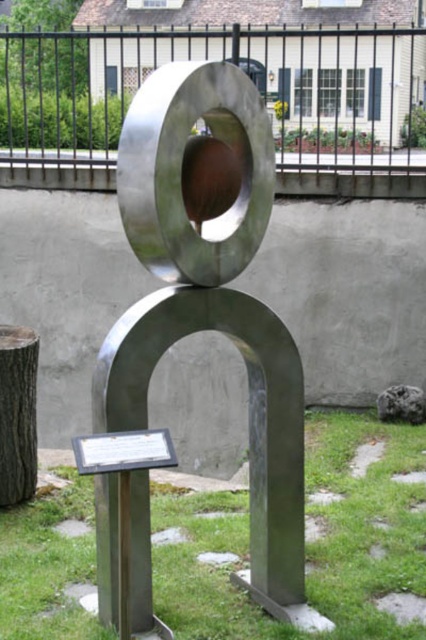
Question: Considering the real-world distances, which object is closest to the green grass at center?

Choices:
 (A) dark brown wood stump at lower left
 (B) polished metal sculpture at center

Answer: (B)

Question: Considering the relative positions of green grass at center and dark brown wood stump at lower left in the image provided, where is green grass at center located with respect to dark brown wood stump at lower left?

Choices:
 (A) above
 (B) below

Answer: (B)

Question: Among these points, which one is farthest from the camera?

Choices:
 (A) (207, 596)
 (B) (264, 454)

Answer: (A)

Question: Is polished metal sculpture at center to the right of dark brown wood stump at lower left from the viewer's perspective?

Choices:
 (A) yes
 (B) no

Answer: (A)

Question: Does polished metal sculpture at center have a larger size compared to green grass at center?

Choices:
 (A) no
 (B) yes

Answer: (A)

Question: Considering the real-world distances, which object is farthest from the dark brown wood stump at lower left?

Choices:
 (A) polished metal sculpture at center
 (B) green grass at center

Answer: (A)